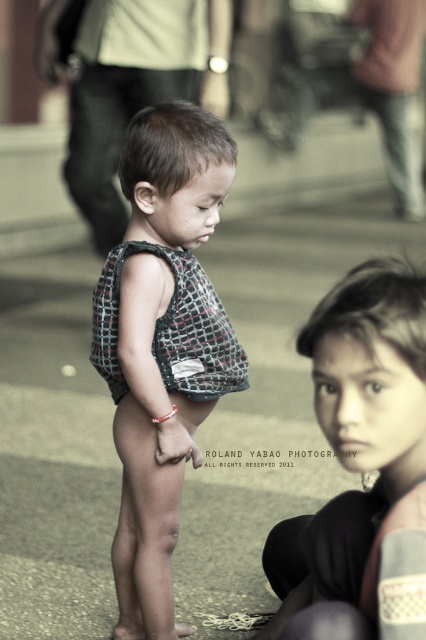
Does gray concrete pavement at center appear under textured fabric shirt at center?

Actually, gray concrete pavement at center is above textured fabric shirt at center.

Does point (45, 602) come farther from viewer compared to point (201, 380)?

Yes.

The image size is (426, 640). In order to click on gray concrete pavement at center in this screenshot , I will do `click(268, 396)`.

Who is positioned more to the left, textured fabric shirt at center or matte black tank top at center?

textured fabric shirt at center

Is textured fabric shirt at center positioned in front of matte black tank top at center?

No, it is behind matte black tank top at center.

Locate an element on the screen. This screenshot has width=426, height=640. textured fabric shirt at center is located at coordinates (161, 344).

Is point (250, 378) farther from camera compared to point (325, 611)?

Yes, it is behind point (325, 611).

Can you confirm if gray concrete pavement at center is smaller than matte black tank top at center?

Incorrect, gray concrete pavement at center is not smaller in size than matte black tank top at center.

Describe the element at coordinates (268, 396) in the screenshot. I see `gray concrete pavement at center` at that location.

Locate an element on the screen. gray concrete pavement at center is located at coordinates (268, 396).